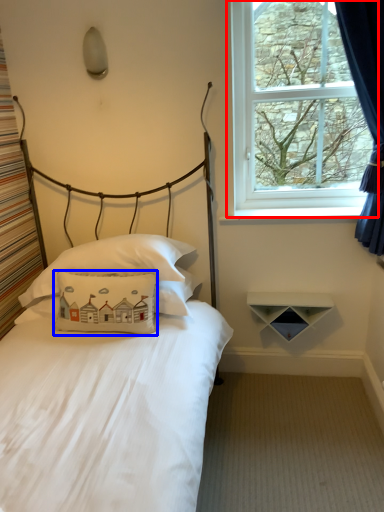
Question: Which point is further to the camera, window (highlighted by a red box) or pillow (highlighted by a blue box)?

Choices:
 (A) window
 (B) pillow

Answer: (A)